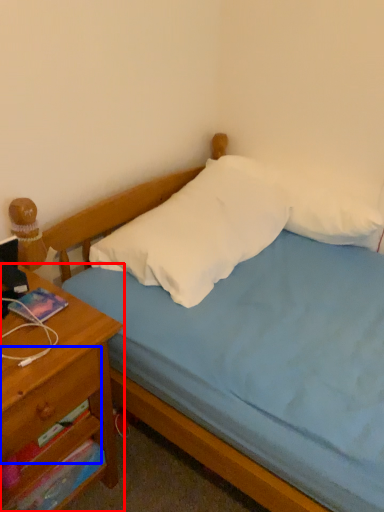
Question: Among these objects, which one is farthest to the camera, nightstand (highlighted by a red box) or drawer (highlighted by a blue box)?

Choices:
 (A) nightstand
 (B) drawer

Answer: (B)